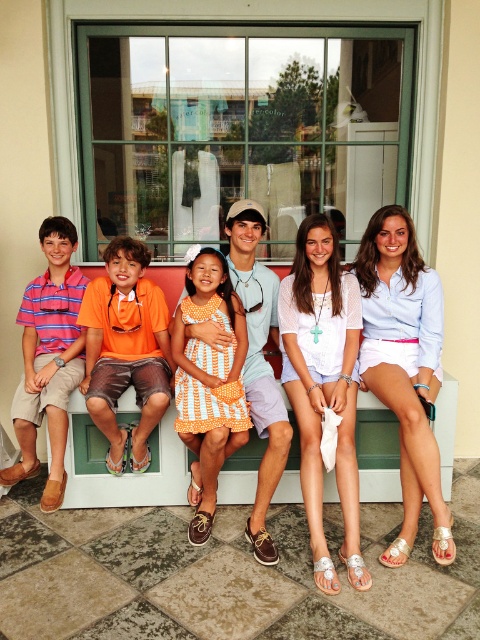
Does orange fabric shorts at left have a greater width compared to orange polka dot dress at center?

Correct, the width of orange fabric shorts at left exceeds that of orange polka dot dress at center.

Can you confirm if orange fabric shorts at left is taller than orange polka dot dress at center?

No, orange fabric shorts at left is not taller than orange polka dot dress at center.

Image resolution: width=480 pixels, height=640 pixels. What do you see at coordinates (126, 349) in the screenshot?
I see `orange fabric shorts at left` at bounding box center [126, 349].

Where is `orange fabric shorts at left`? This screenshot has width=480, height=640. orange fabric shorts at left is located at coordinates (126, 349).

Is white lace top at center taller than white cotton dress at center?

Correct, white lace top at center is much taller as white cotton dress at center.

Can you confirm if white lace top at center is positioned above white cotton dress at center?

No, white lace top at center is not above white cotton dress at center.

Locate an element on the screen. This screenshot has width=480, height=640. white lace top at center is located at coordinates (324, 385).

Can you confirm if light blue cotton shirt at center is positioned above orange fabric shorts at left?

No, light blue cotton shirt at center is not above orange fabric shorts at left.

Where is `light blue cotton shirt at center`? light blue cotton shirt at center is located at coordinates (405, 364).

Which is in front, point (406, 406) or point (160, 321)?

Positioned in front is point (406, 406).

Image resolution: width=480 pixels, height=640 pixels. In order to click on light blue cotton shirt at center in this screenshot , I will do `click(405, 364)`.